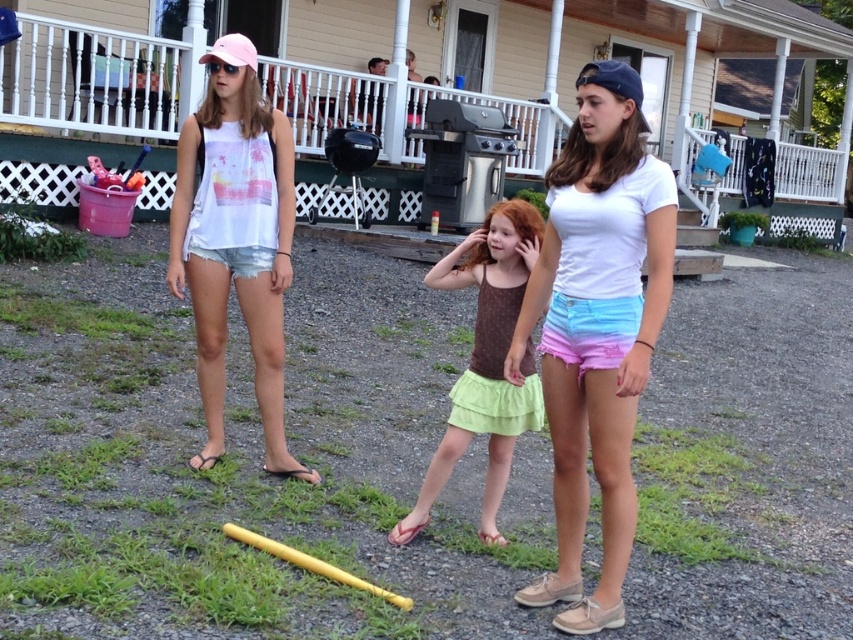
Does white cotton t-shirt at center have a lesser width compared to brown dotted tank top at center?

Yes.

Which is in front, point (625, 420) or point (439, 490)?

Point (625, 420)

Between point (527, 592) and point (482, 273), which one is positioned in front?

Point (527, 592) is more forward.

Locate an element on the screen. Image resolution: width=853 pixels, height=640 pixels. white cotton t-shirt at center is located at coordinates (596, 328).

Does brown dotted tank top at center have a lesser height compared to yellow matte baseball bat at lower center?

No.

Can you confirm if brown dotted tank top at center is bigger than yellow matte baseball bat at lower center?

Correct, brown dotted tank top at center is larger in size than yellow matte baseball bat at lower center.

Measure the distance between point (529, 364) and camera.

They are 13.20 feet apart.

Locate an element on the screen. brown dotted tank top at center is located at coordinates (486, 362).

Measure the distance between wooden porch at upper center and brown dotted tank top at center.

A distance of 42.03 feet exists between wooden porch at upper center and brown dotted tank top at center.

What do you see at coordinates (570, 90) in the screenshot? I see `wooden porch at upper center` at bounding box center [570, 90].

Image resolution: width=853 pixels, height=640 pixels. What are the coordinates of `wooden porch at upper center` in the screenshot? It's located at (570, 90).